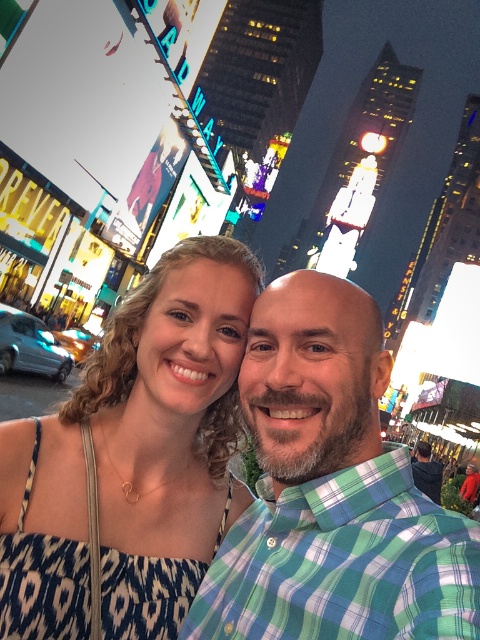
Is blue printed dress at center above green plaid shirt at center?

Yes, blue printed dress at center is above green plaid shirt at center.

The width and height of the screenshot is (480, 640). I want to click on blue printed dress at center, so click(132, 458).